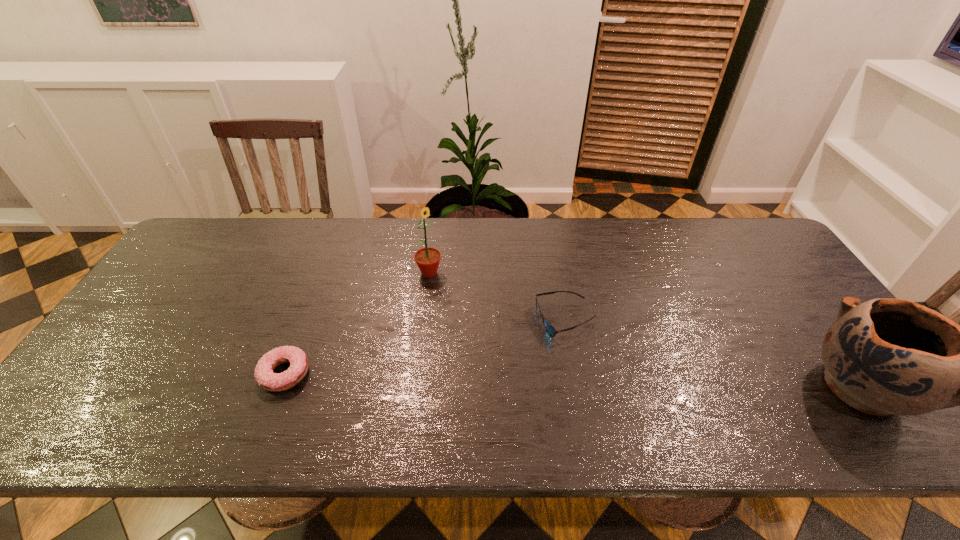
I want to click on vacant space on the desktop that is between the doughnut and the pottery and is positioned at the front of the second object from right to left showing the lenses, so click(x=516, y=379).

Where is `free space on the desktop that is between the leftmost object and the rightmost object and is positioned on the face of the sunflower`? This screenshot has height=540, width=960. free space on the desktop that is between the leftmost object and the rightmost object and is positioned on the face of the sunflower is located at coordinates (541, 380).